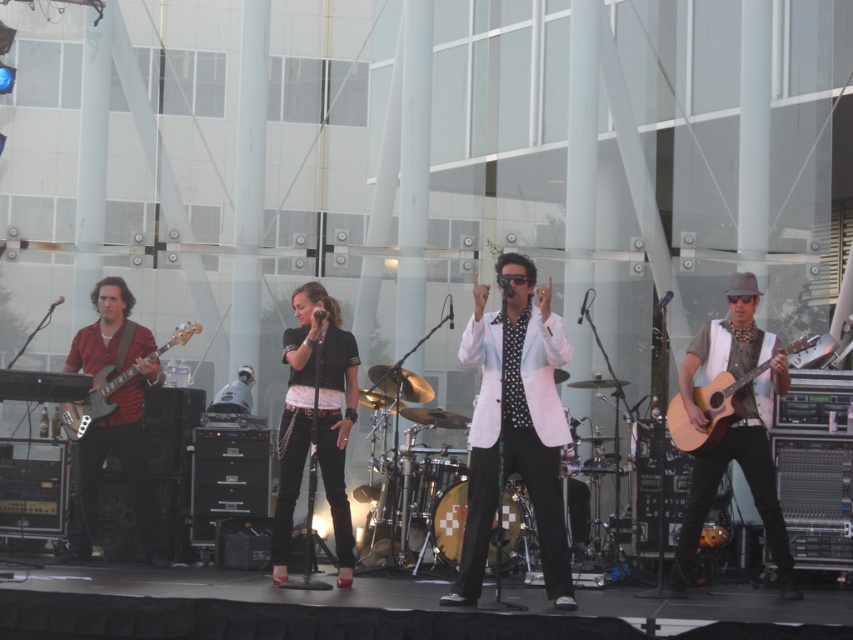
You are standing in front of the stage watching the band perform. The stage is 10 meters away from you. You want to hand the guitarist a drink. Can you reach the matte red guitar at left from your current position?

The matte red guitar at left is 10.17 meters away from the viewer. Since the stage is only 10 meters away, you cannot reach the matte red guitar at left as it is slightly further than the stage distance.

You are standing in front of the stage and want to determine which of the two points, point (529,397) or point (715,436), is closer to you. Based on the scene description, which point is nearer?

Point (529,397) is closer to the viewer than point (715,436).

You are a photographer standing at the center of the stage. You want to take a photo of the white glossy jacket at center. Where should you aim your camera to capture the jacket in the frame?

You should aim your camera at the coordinates point (x=514, y=381) to capture the white glossy jacket at center in the frame.